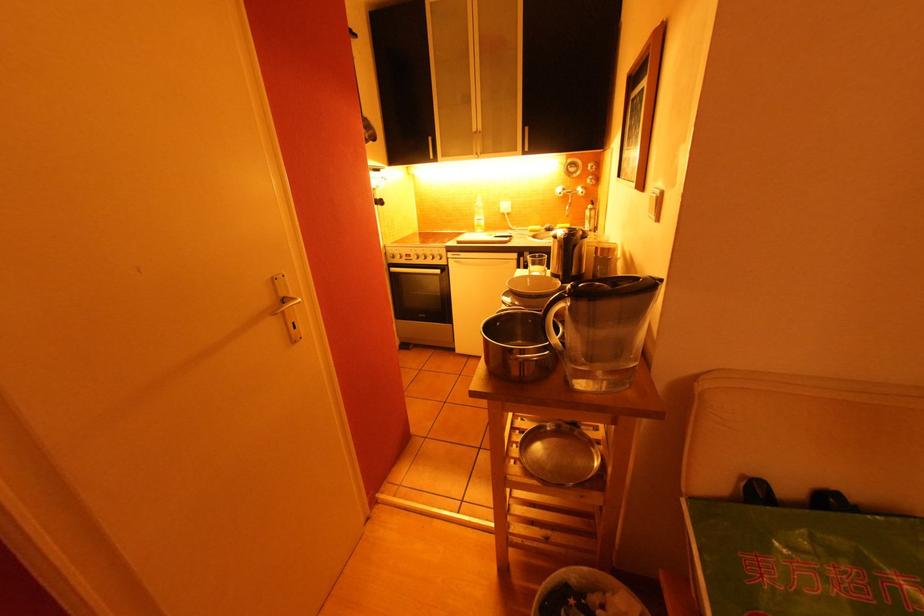
Find where to turn the oven knob. Please return your answer as a coordinate pair (x, y).

(416, 254)